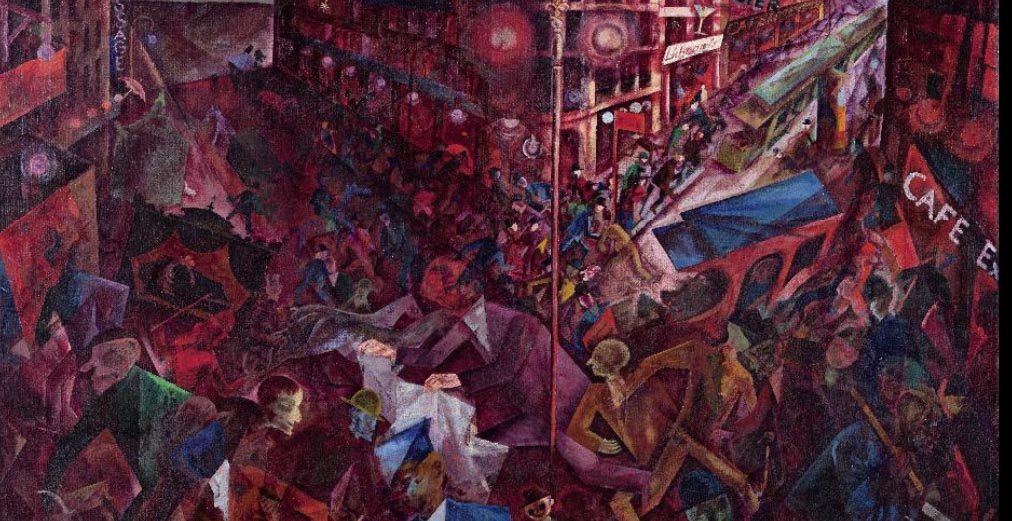
Locate an element on the screen. The width and height of the screenshot is (1012, 521). second level windows is located at coordinates (605, 85), (629, 74), (643, 70).